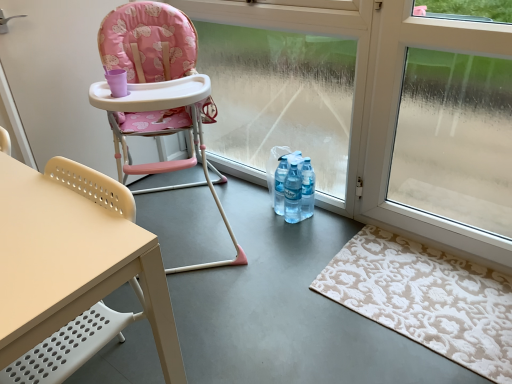
Identify the location of unoccupied region to the right of pink fabric highchair at left, marked as the 2th chair in a front-to-back arrangement. (296, 244).